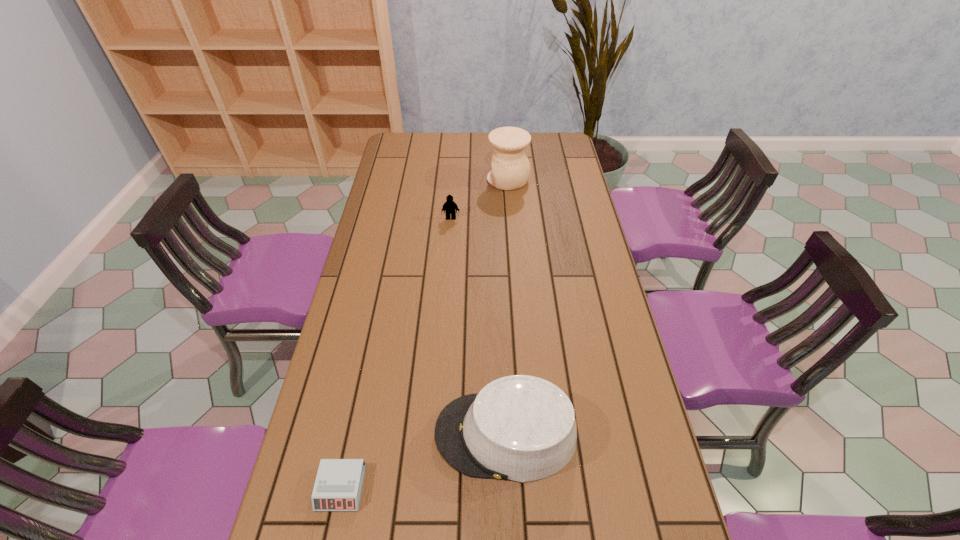
Locate an element on the screen. pottery is located at coordinates (510, 166).

This screenshot has height=540, width=960. In order to click on the tallest object in this screenshot , I will do `click(510, 166)`.

Image resolution: width=960 pixels, height=540 pixels. Identify the location of hat. (521, 428).

This screenshot has height=540, width=960. What are the coordinates of `the second shortest object` in the screenshot? It's located at pyautogui.click(x=449, y=206).

The image size is (960, 540). Identify the location of Lego. (449, 206).

I want to click on the shortest object, so click(338, 485).

At what (x,y) coordinates should I click in order to perform the action: click on the leftmost object. Please return your answer as a coordinate pair (x, y). Looking at the image, I should click on click(338, 485).

Where is `vacant space positioned at the open side of the farthest object`? The height and width of the screenshot is (540, 960). vacant space positioned at the open side of the farthest object is located at coordinates [x=440, y=180].

This screenshot has width=960, height=540. Identify the location of vacant space located 0.170m at the open side of the farthest object. (446, 180).

Locate an element on the screen. The height and width of the screenshot is (540, 960). free location located 0.060m at the open side of the farthest object is located at coordinates (473, 180).